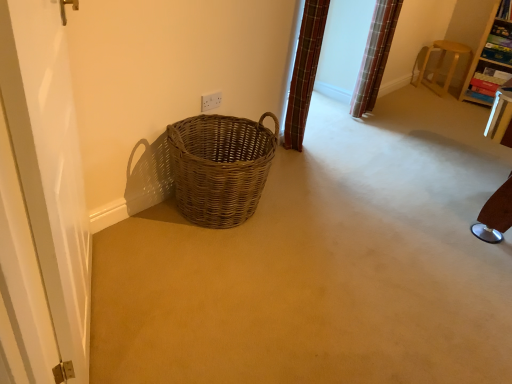
Where is `free location in front of woven brown basket at center`? free location in front of woven brown basket at center is located at coordinates (209, 268).